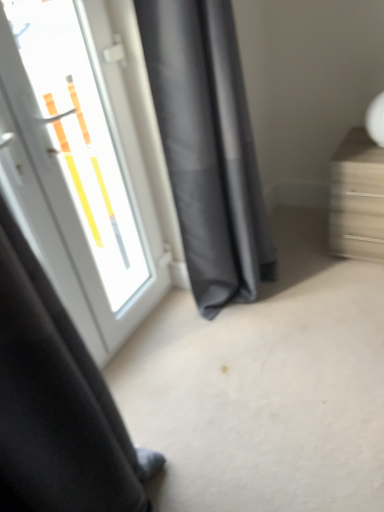
Find the location of a particular element. The height and width of the screenshot is (512, 384). free space that is to the left of wooden drawer at right is located at coordinates (x=306, y=252).